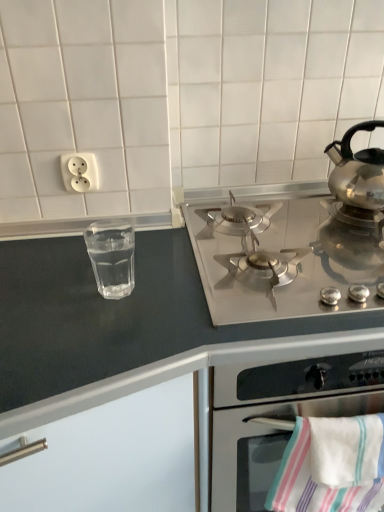
Question: From their relative heights in the image, would you say stainless steel gas stove at upper center is taller or shorter than white striped towel at lower right?

Choices:
 (A) tall
 (B) short

Answer: (A)

Question: From a real-world perspective, relative to white striped towel at lower right, is stainless steel gas stove at upper center vertically above or below?

Choices:
 (A) below
 (B) above

Answer: (A)

Question: Which object is positioned farthest from the satin silver gas stove at upper right?

Choices:
 (A) white striped towel at lower right
 (B) transparent glass at left
 (C) polished stainless steel kettle at right
 (D) white plastic outlet at upper left
 (E) stainless steel gas stove at upper center

Answer: (D)

Question: Estimate the real-world distances between objects in this image. Which object is farther from the polished stainless steel kettle at right?

Choices:
 (A) white plastic outlet at upper left
 (B) white striped towel at lower right
 (C) transparent glass at left
 (D) stainless steel gas stove at upper center
 (E) satin silver gas stove at upper right

Answer: (A)